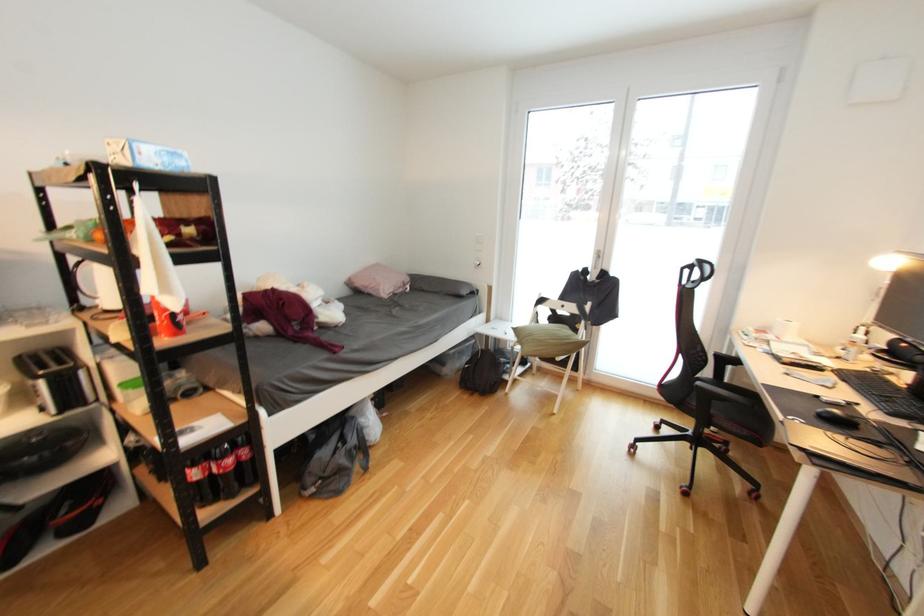
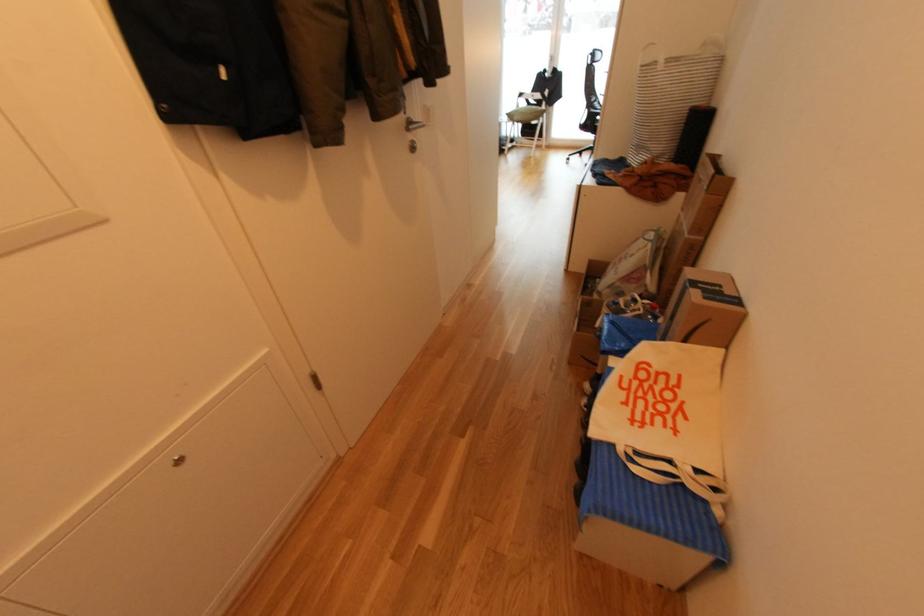
In a continuous first-person perspective shot, in which direction is the camera moving?

The cameraman walked toward left, backward.